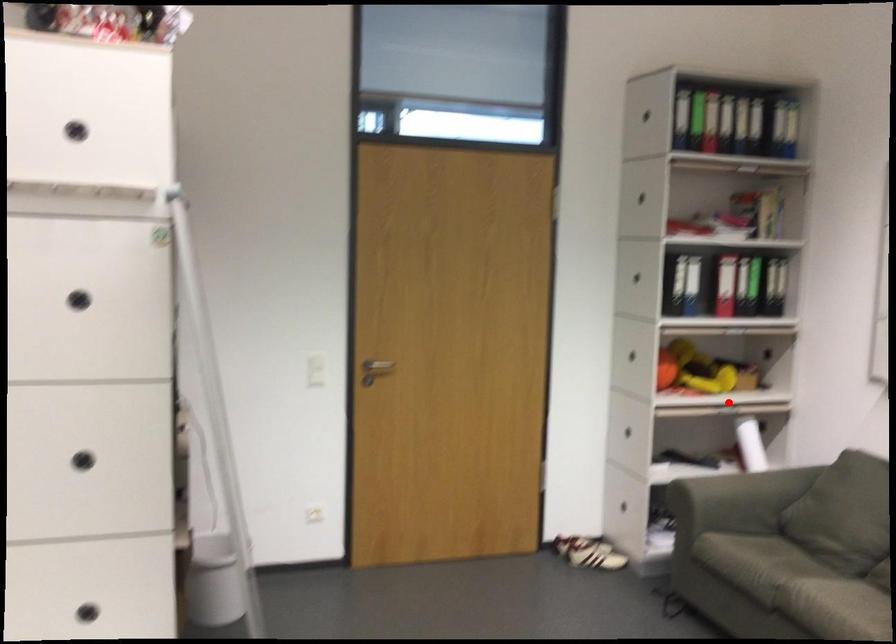
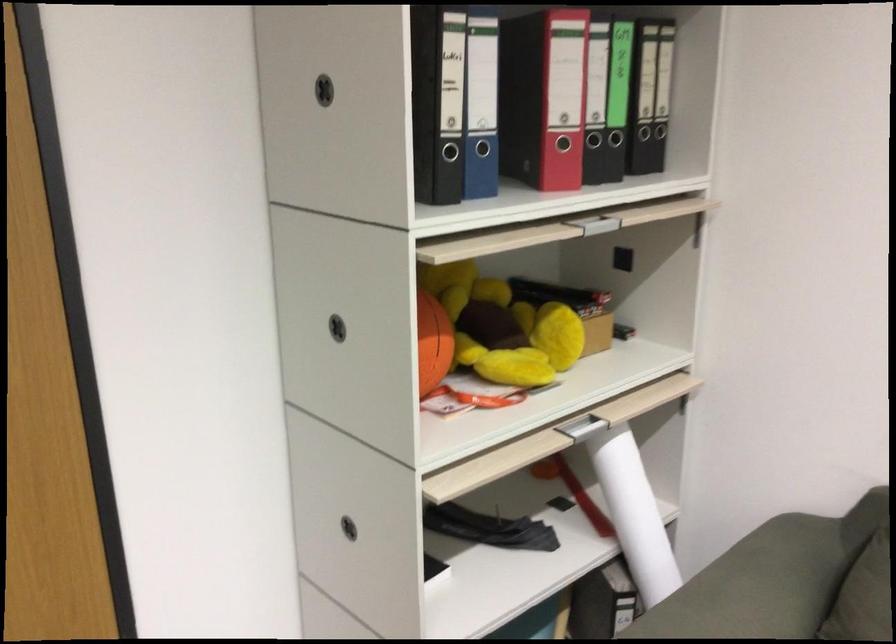
The point at the highlighted location is marked in the first image. Where is the corresponding point in the second image?

(595, 421)